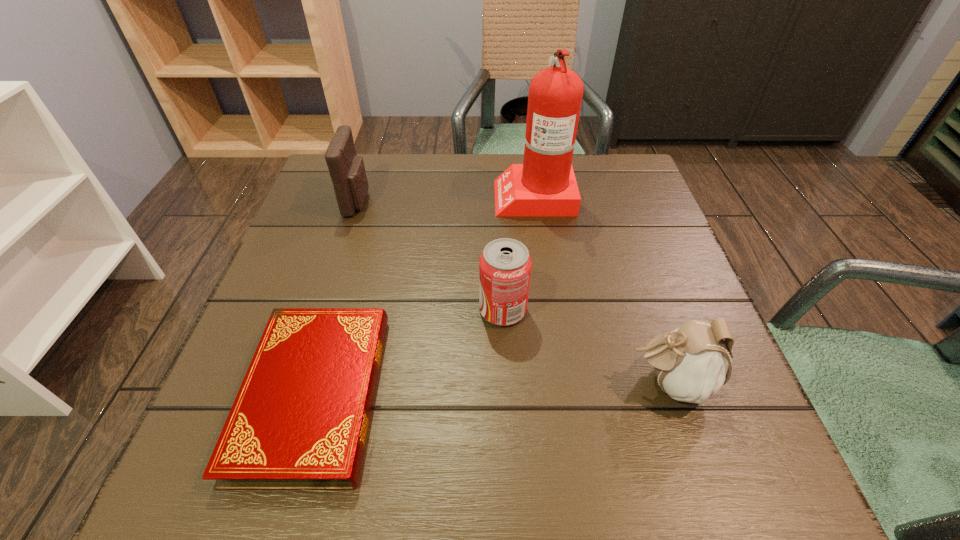
Where is `free spot between the fire extinguisher and the hardback book`? This screenshot has height=540, width=960. free spot between the fire extinguisher and the hardback book is located at coordinates (424, 294).

Identify the location of unoccupied area between the tallest object and the rightmost object. (601, 289).

In order to click on vacant area that lies between the shortest object and the nearer pouch in this screenshot , I will do `click(492, 388)`.

At what (x,y) coordinates should I click in order to perform the action: click on empty location between the nearer pouch and the hardback book. Please return your answer as a coordinate pair (x, y). Looking at the image, I should click on (492, 388).

Where is `free spot between the hardback book and the left pouch`? The width and height of the screenshot is (960, 540). free spot between the hardback book and the left pouch is located at coordinates (336, 298).

Locate an element on the screen. This screenshot has height=540, width=960. empty space that is in between the shortest object and the soda can is located at coordinates (409, 352).

Locate an element on the screen. This screenshot has height=540, width=960. empty space between the nearer pouch and the soda can is located at coordinates (586, 346).

This screenshot has width=960, height=540. Find the location of `vacant space in between the soda can and the farther pouch`. vacant space in between the soda can and the farther pouch is located at coordinates (430, 255).

Identify the location of free spot between the left pouch and the hardback book. This screenshot has height=540, width=960. (336, 298).

Locate which object ranks in proximity to the tallest object. Please provide its 2D coordinates. Your answer should be formatted as a tuple, i.e. [(x, y)], where the tuple contains the x and y coordinates of a point satisfying the conditions above.

[(505, 265)]